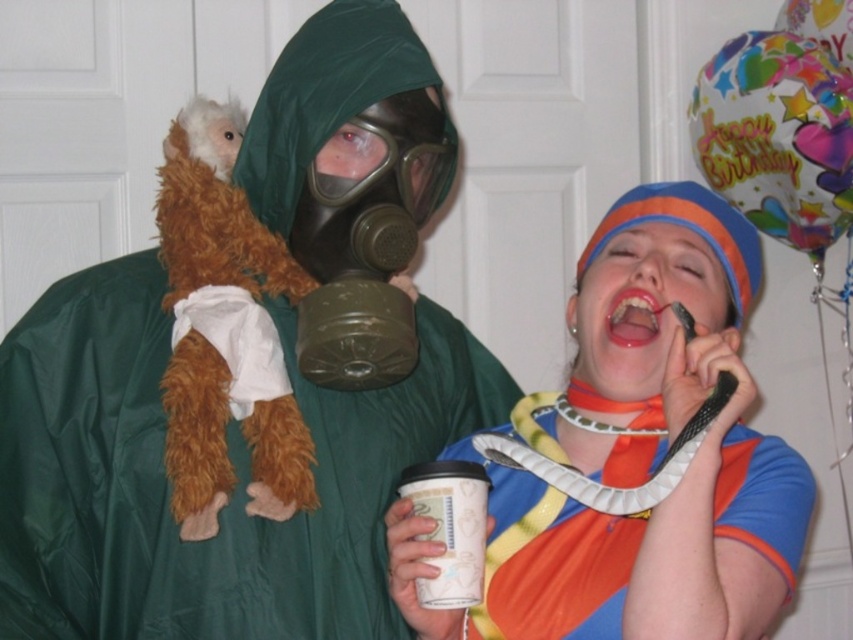
You are a delivery robot that needs to place a small package on the table. The package is the size of the white paper cup at lower center. Can you safely place it near the matte plastic snake at right without knocking it over?

The matte plastic snake at right is taller than the white paper cup at lower center. Since the snake is taller, placing the package near it should be safe as the cup won

Looking at this image, you are a visitor in the room and want to find the matte plastic snake at right. Where should you look relative to the colorful paper balloon at upper right?

The matte plastic snake at right is located below the colorful paper balloon at upper right, so look downward from the balloon to find it.

You are a delivery person who needs to place a package on the floor between the green matte raincoat at left and the colorful paper balloon at upper right. Can you estimate whether the space between them is wide enough for the package?

The green matte raincoat at left is taller than the colorful paper balloon at upper right, but the description does not provide information about the horizontal distance between them. Therefore, it is impossible to determine if the space is wide enough for the package based on the given details.